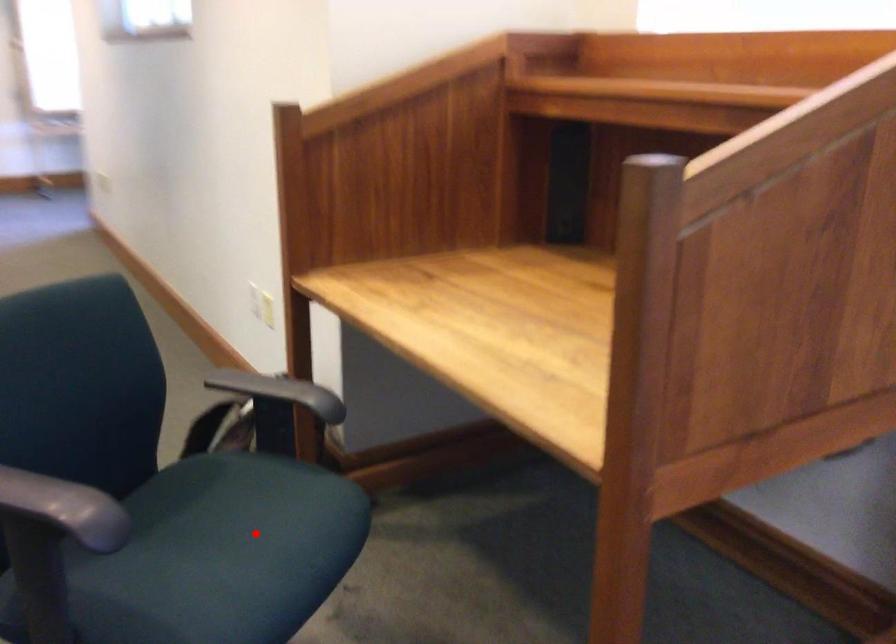
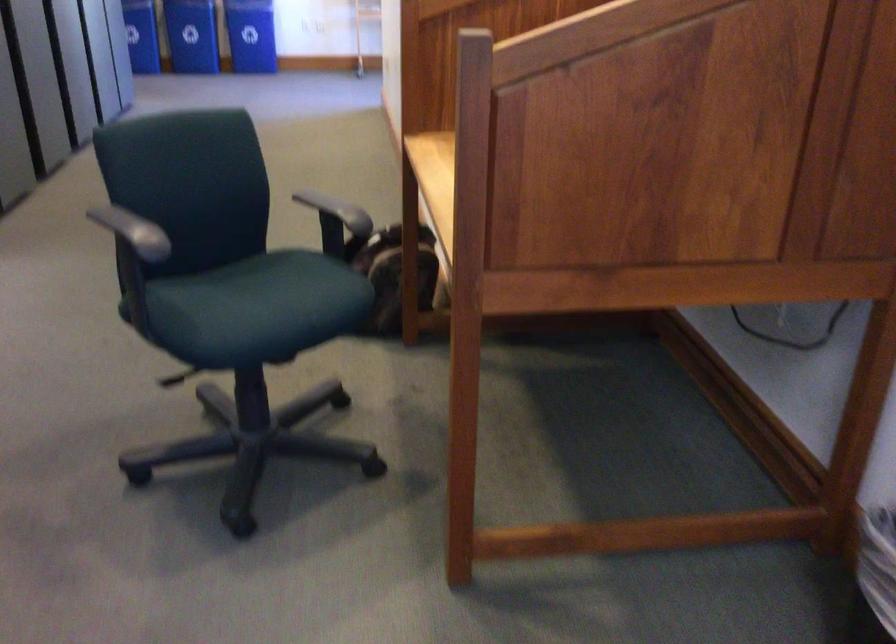
Question: I am providing you with two images of the same scene from different viewpoints. In image1, a red point is highlighted. Considering the same 3D point in image2, which of the following is correct?

Choices:
 (A) It is closer
 (B) It is farther

Answer: (B)